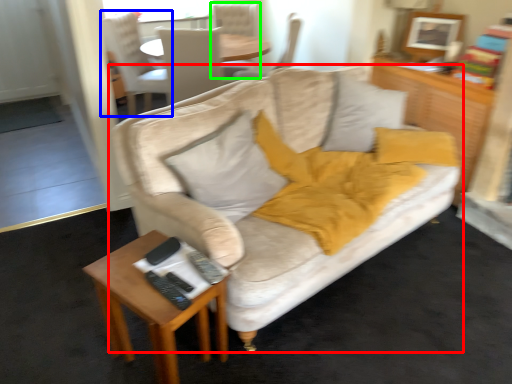
Question: Estimate the real-world distances between objects in this image. Which object is closer to studio couch (highlighted by a red box), chair (highlighted by a blue box) or chair (highlighted by a green box)?

Choices:
 (A) chair
 (B) chair

Answer: (A)